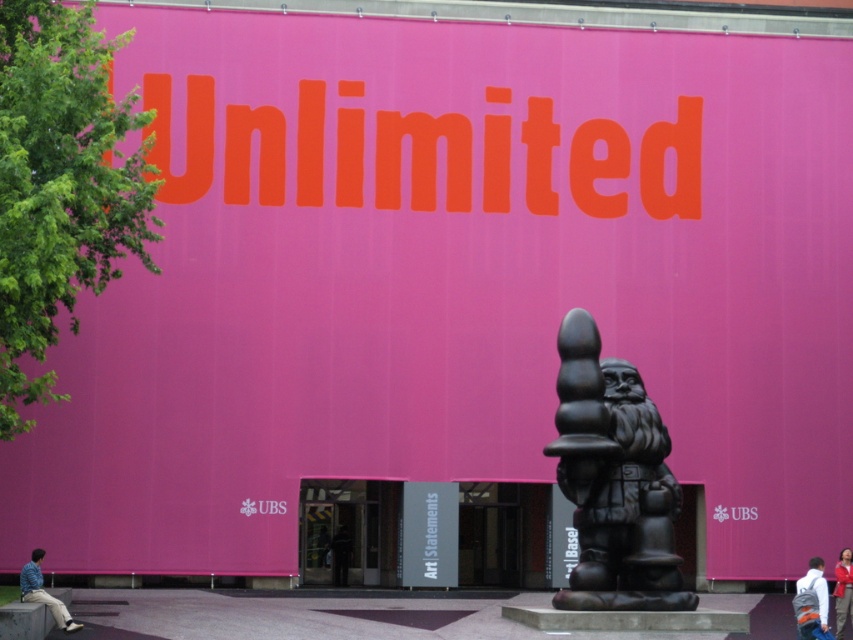
Does black matte statue at center have a lesser height compared to blue striped shirt at lower left?

Yes, black matte statue at center is shorter than blue striped shirt at lower left.

Is black matte statue at center positioned behind blue striped shirt at lower left?

Yes, black matte statue at center is further from the viewer.

Find the location of `black matte statue at center`. black matte statue at center is located at coordinates (614, 481).

Locate an element on the screen. The height and width of the screenshot is (640, 853). black matte statue at center is located at coordinates (614, 481).

Does point (567, 605) come behind point (813, 600)?

Yes, point (567, 605) is behind point (813, 600).

Between black matte statue at center and white fabric backpack at lower right, which one has less height?

Standing shorter between the two is black matte statue at center.

Where is `black matte statue at center`? This screenshot has width=853, height=640. black matte statue at center is located at coordinates (614, 481).

Who is higher up, blue striped shirt at lower left or red fabric person at lower right?

red fabric person at lower right is higher up.

Is blue striped shirt at lower left thinner than red fabric person at lower right?

Incorrect, blue striped shirt at lower left's width is not less than red fabric person at lower right's.

Is point (38, 598) positioned in front of point (840, 554)?

That is True.

The height and width of the screenshot is (640, 853). I want to click on blue striped shirt at lower left, so click(44, 593).